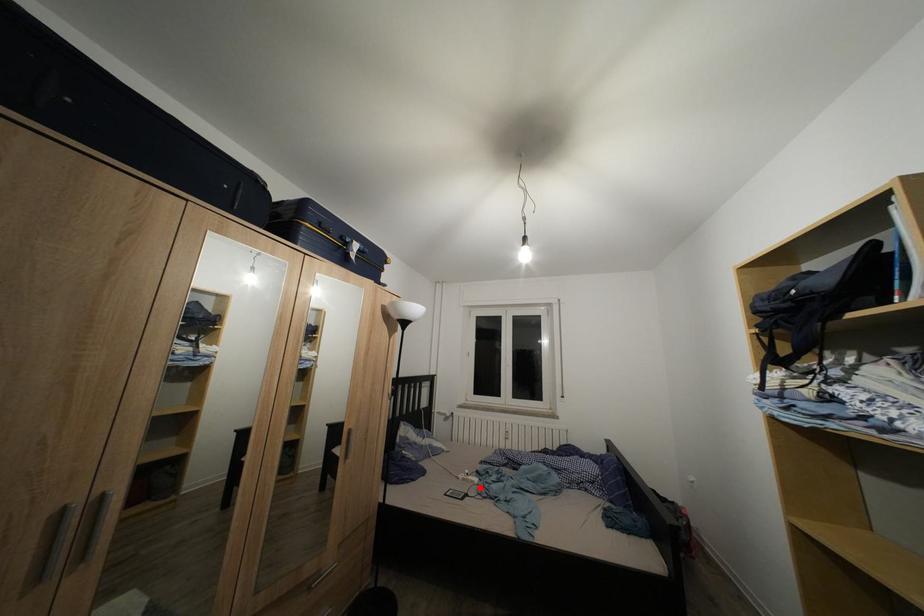
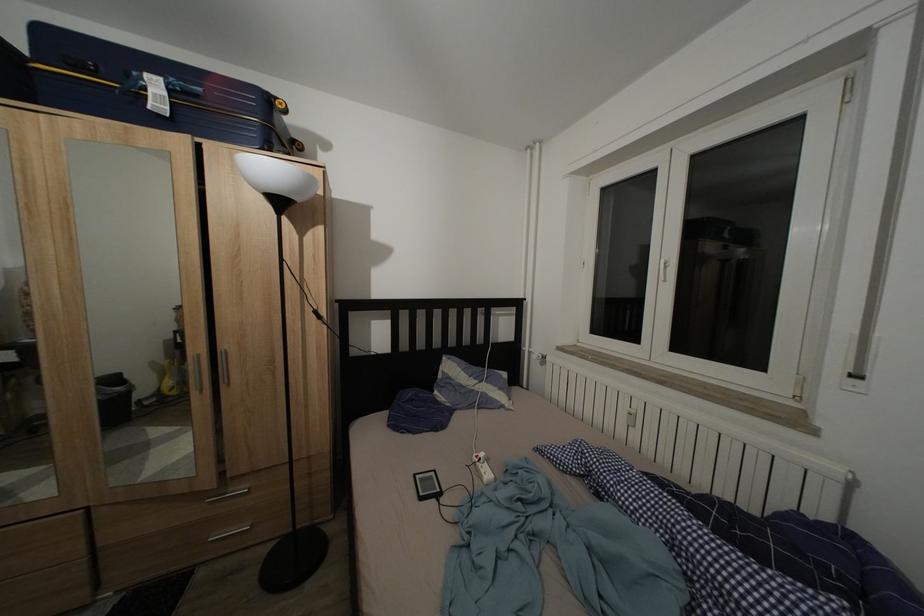
Find the pixel in the second image that matches the highlighted location in the first image.

(488, 483)